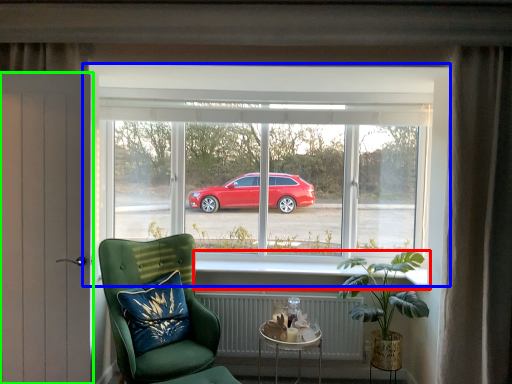
Question: Considering the real-world distances, which object is farthest from window sill (highlighted by a red box)? window (highlighted by a blue box) or door (highlighted by a green box)?

Choices:
 (A) window
 (B) door

Answer: (B)